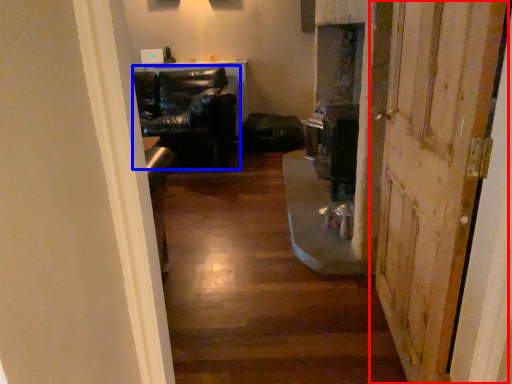
Question: Among these objects, which one is farthest to the camera, door (highlighted by a red box) or chair (highlighted by a blue box)?

Choices:
 (A) door
 (B) chair

Answer: (B)